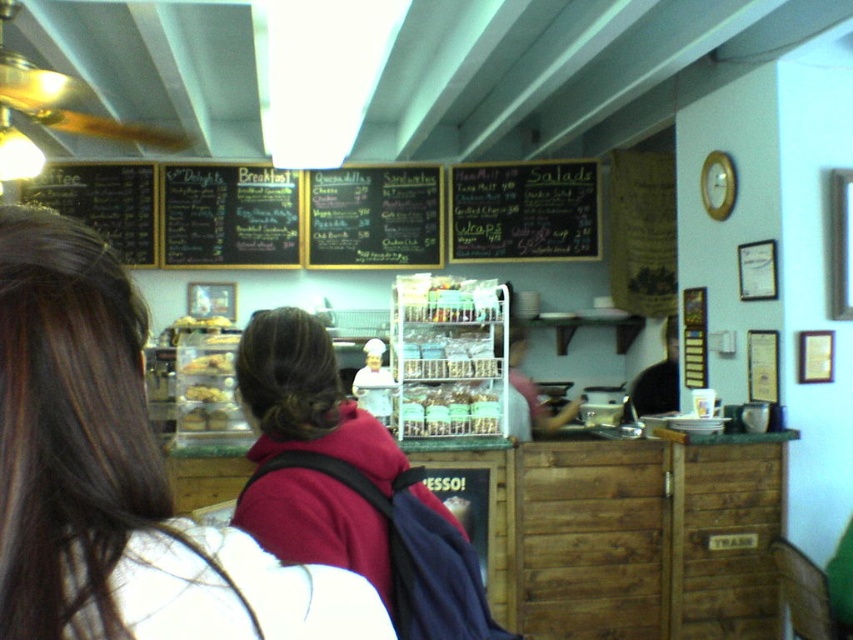
What do you see at coordinates (523, 211) in the screenshot? The height and width of the screenshot is (640, 853). I see `black chalkboard at center` at bounding box center [523, 211].

Can you confirm if black chalkboard at center is shorter than translucent plastic containers at center?

Incorrect, black chalkboard at center's height does not fall short of translucent plastic containers at center's.

Which is in front, point (471, 186) or point (480, 419)?

Point (480, 419) is in front.

What are the coordinates of `black chalkboard at center` in the screenshot? It's located at (523, 211).

Can you confirm if maroon fleece jacket at center is smaller than black chalkboard menu at center?

Incorrect, maroon fleece jacket at center is not smaller in size than black chalkboard menu at center.

Who is more forward, (358, 433) or (341, 200)?

Positioned in front is point (358, 433).

The height and width of the screenshot is (640, 853). In order to click on maroon fleece jacket at center in this screenshot , I will do `click(306, 397)`.

Who is taller, matte black hair at upper left or matte plastic bagel at center?

matte black hair at upper left is taller.

Is point (94, 243) positioned before point (218, 372)?

Yes, it is.

Who is more forward, (158, 486) or (200, 371)?

Point (158, 486)

What are the coordinates of `matte black hair at upper left` in the screenshot? It's located at (119, 476).